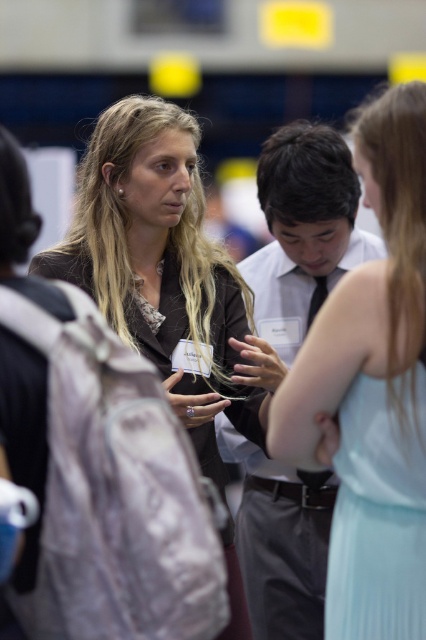
You are at a networking event and see a person wearing a matte black jacket at center and a white shirt at center. Which clothing item is positioned lower on the person?

The matte black jacket at center is located below the white shirt at center, so the matte black jacket at center is positioned lower on the person.

You are standing in the conference room and want to approach the person wearing the matte black jacket at center and the white shirt at center. Which one should you walk towards first to reach them in the correct order?

You should walk towards the matte black jacket at center first because it is closer to you than the white shirt at center, so reaching it first maintains the correct order.